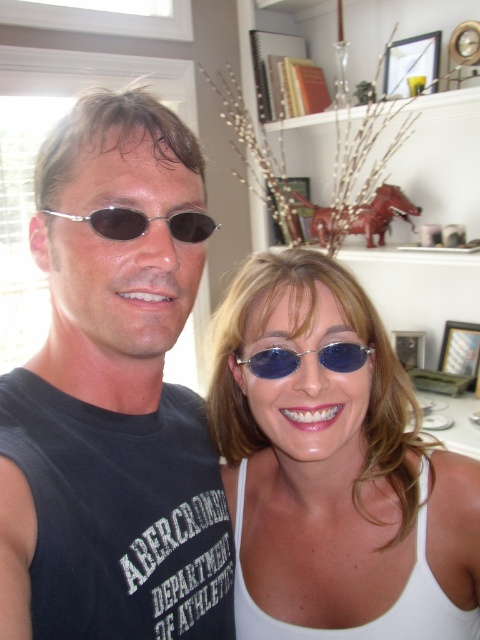
You are a photographer setting up a shoot in this room. You need to place a small tripod between the satin white tank top at center and the sunglasses at center. Based on their positions, where should you place the tripod?

The satin white tank top at center is positioned under the sunglasses at center, so the tripod should be placed between them, below the sunglasses at center and above the satin white tank top at center.

From the picture: You are a photographer trying to capture a clear shot of both the satin white tank top at center and the blue metallic sunglasses at center. Since you can only focus on one object at a time, which one should you focus on first to ensure the other is also in focus?

You should focus on the blue metallic sunglasses at center first because the satin white tank top at center is to the right of it, so focusing on the closer object will keep both in focus.